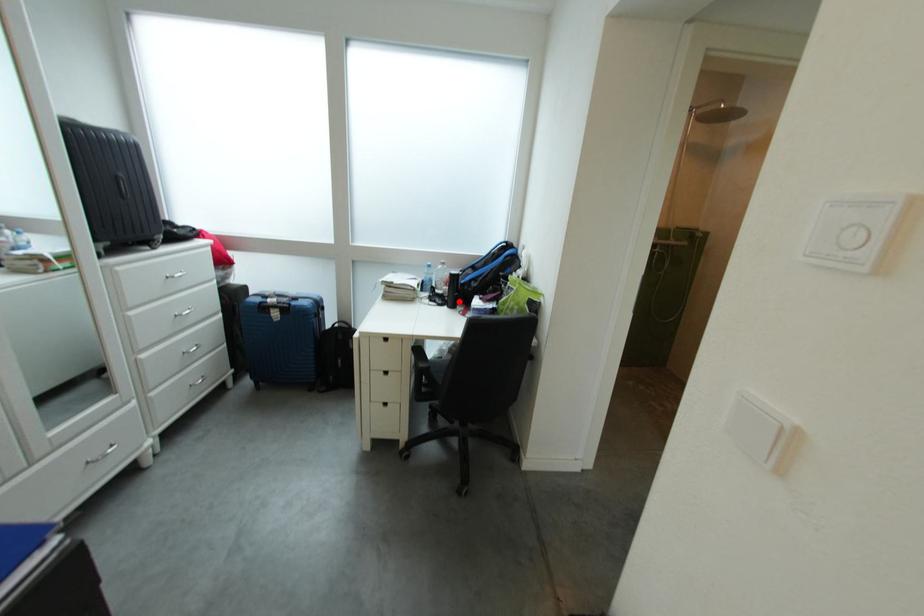
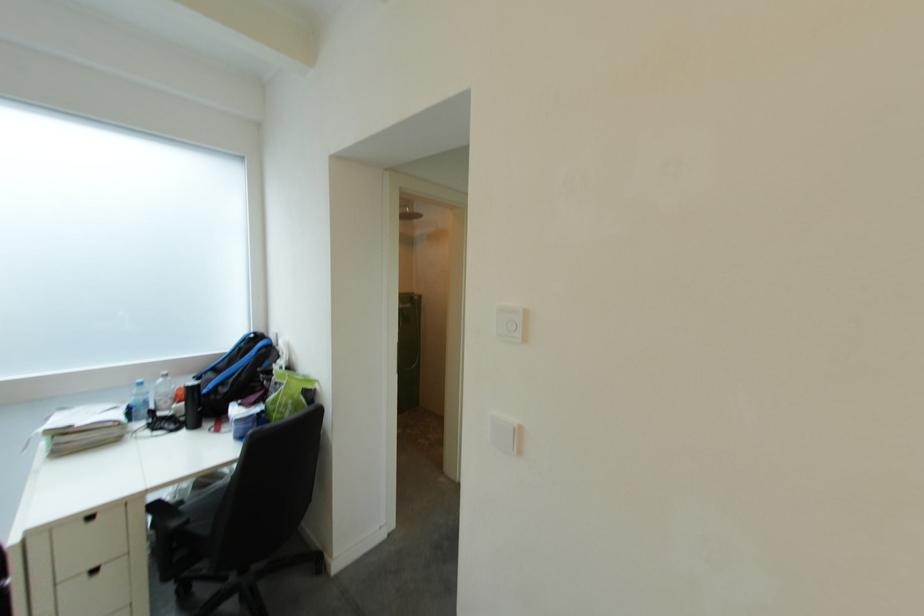
The point at the highlighted location is marked in the first image. Where is the corresponding point in the second image?

(195, 422)